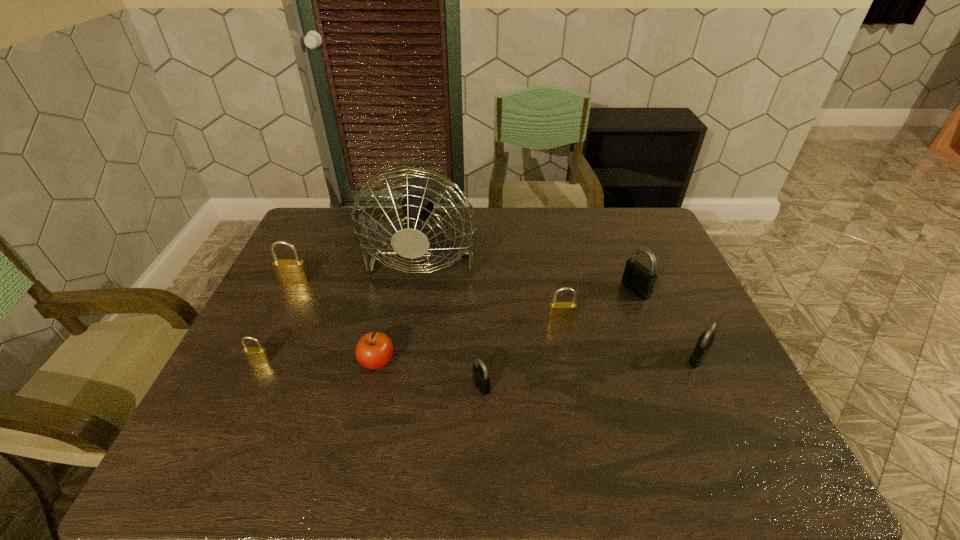
What are the coordinates of `object positioned at the far edge` in the screenshot? It's located at (408, 242).

I want to click on vacant space at the far edge, so click(x=564, y=207).

The width and height of the screenshot is (960, 540). I want to click on free location at the near edge, so click(x=502, y=447).

Locate an element on the screen. Image resolution: width=960 pixels, height=540 pixels. vacant space at the left edge of the desktop is located at coordinates (232, 410).

Where is `free space at the right edge of the desktop`? The height and width of the screenshot is (540, 960). free space at the right edge of the desktop is located at coordinates (667, 256).

The image size is (960, 540). In the image, there is a desktop. Identify the location of vacant space at the far left corner. (347, 219).

In the image, there is a desktop. What are the coordinates of `vacant space at the far right corner` in the screenshot? It's located at (652, 226).

Where is `free area in between the third padlock from right to left and the farthest brass padlock`? free area in between the third padlock from right to left and the farthest brass padlock is located at coordinates (428, 301).

The width and height of the screenshot is (960, 540). I want to click on free area in between the fan and the apple, so click(401, 306).

The height and width of the screenshot is (540, 960). What are the coordinates of `free spot between the apple and the rightmost black padlock` in the screenshot? It's located at (538, 360).